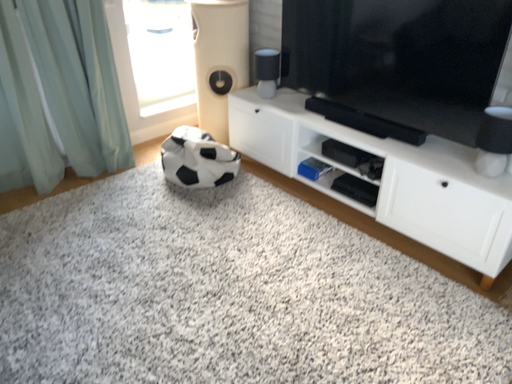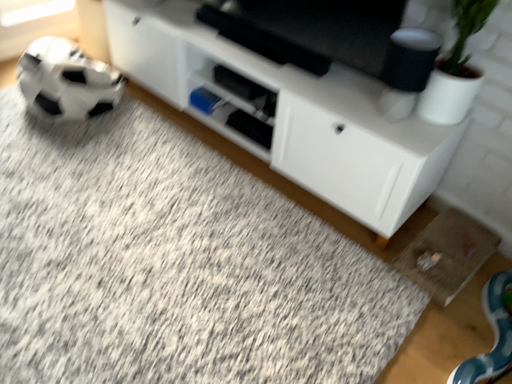
Question: How did the camera likely rotate when shooting the video?

Choices:
 (A) rotated downward
 (B) rotated upward

Answer: (A)